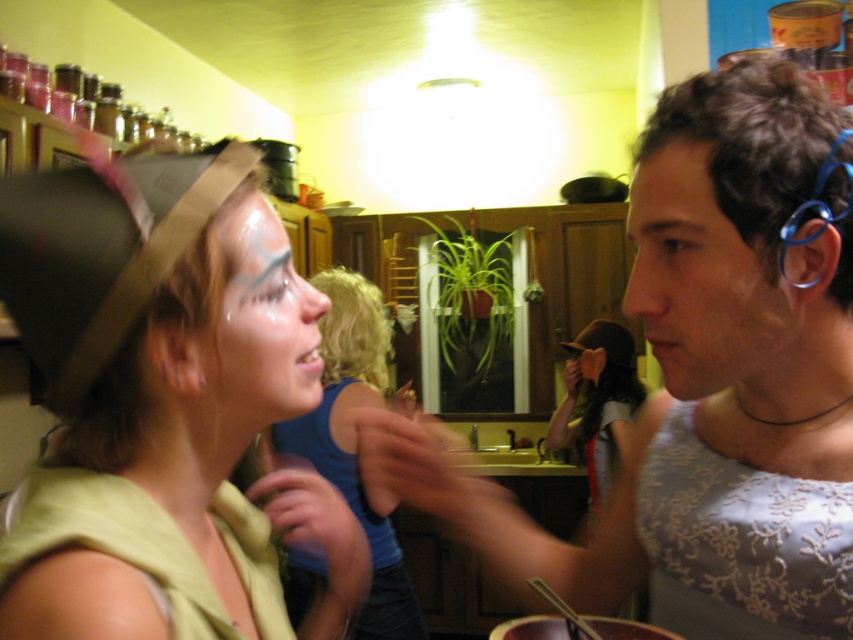
You are a photographer setting up a photo shoot in this kitchen scene. You notice the matte gray tank top at center and the matte skin face at center. Which object would you need to adjust your camera focus on first if you want to ensure both are in focus, considering their sizes?

The matte gray tank top at center is bigger than the matte skin face at center. To ensure both are in focus, you should adjust your camera focus on the smaller object, the matte skin face at center first, as it requires more precise focusing due to its smaller size.

You are a photographer setting up a shot in this kitchen scene. You need to ensure that the matte green fabric at center and the matte skin face at center are both visible in the frame. Given their relative heights, which object should you position closer to the camera to maintain both in focus?

The matte skin face at center should be positioned closer to the camera since the matte green fabric at center is taller. This way, both objects will be in focus without one blocking the other.

You are organizing a costume party and need to ensure that the blue fabric shirt at center and the glossy white face paint at center are visible to all guests. Given their sizes, which item will be more noticeable from a distance?

The blue fabric shirt at center will be more noticeable from a distance because it has a larger size compared to the glossy white face paint at center.